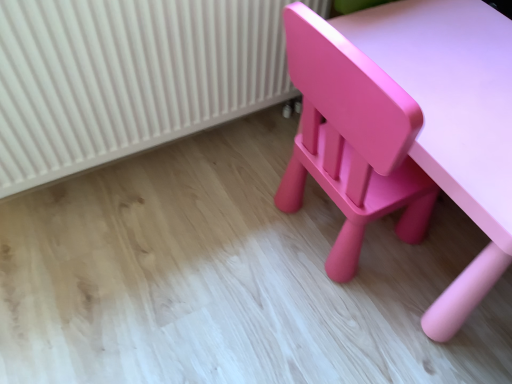
You are a GUI agent. You are given a task and a screenshot of the screen. Output one action in this format:
    pyautogui.click(x=<x>, y=<y>)
    Task: Click on the vacant space that is to the left of matte pink table at lower right
    Image resolution: width=512 pixels, height=384 pixels.
    Given the screenshot: What is the action you would take?
    pyautogui.click(x=224, y=239)